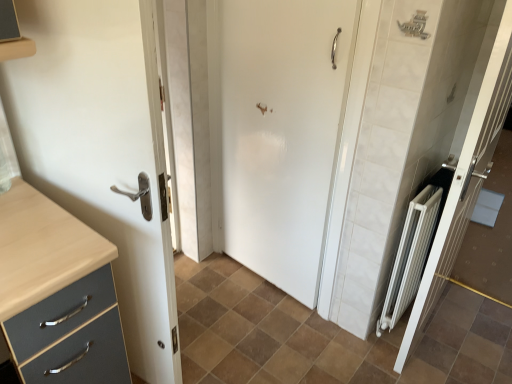
This screenshot has height=384, width=512. Identify the location of vacant region under white metallic radiator at right, marked as the third door in a left-to-right arrangement (from a real-world perspective). (430, 337).